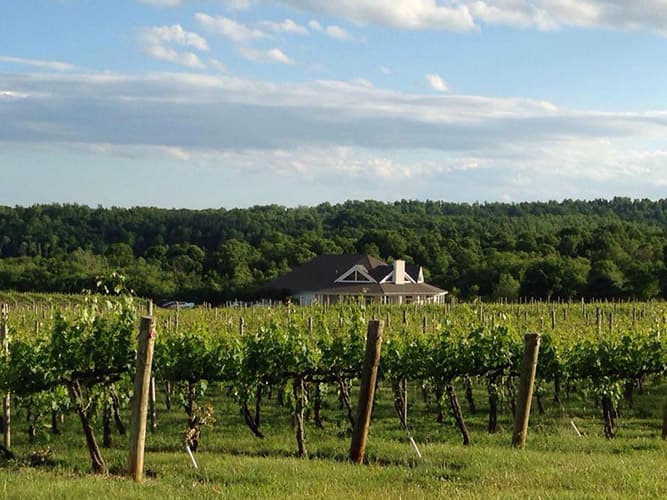
Locate an element on the screen. Image resolution: width=667 pixels, height=500 pixels. chimney is located at coordinates (398, 278).